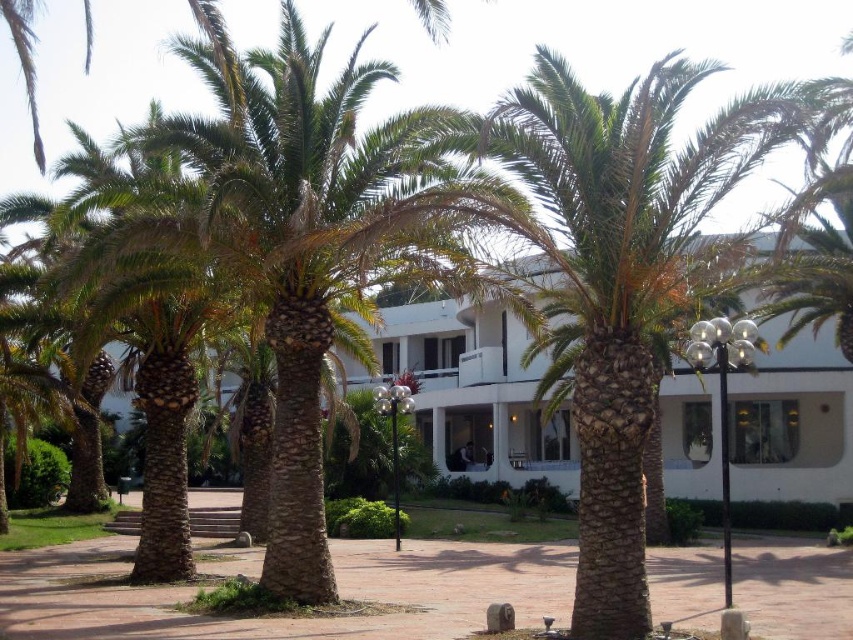
Which of these two, green textured palm tree at center or white smooth building at center, stands shorter?

white smooth building at center is shorter.

Between point (570, 243) and point (817, 499), which one is positioned in front?

Point (570, 243) is more forward.

Identify the location of green textured palm tree at center. (618, 272).